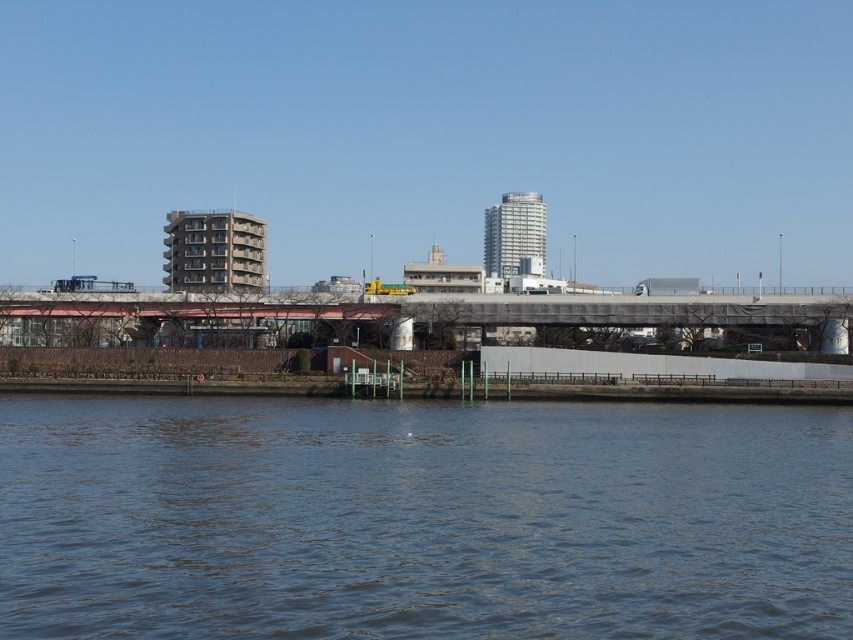
You are standing at the riverside and want to take a photo that includes both the blue water at lower center and the metallic gray bridge at center. Which object should you frame first to ensure both are visible in the photo?

You should frame the blue water at lower center first because it is larger than the metallic gray bridge at center, so capturing its full size will naturally include the bridge in the shot.

You are standing at the riverside and want to take a photo of both point (509, 618) and point (128, 317) in the scene. Which point should you focus on first to ensure both are in sharp focus?

You should focus on point (509, 618) first because it is closer to the camera than point (128, 317), ensuring both will be in focus when using depth of field properly.

You are a delivery drone with a wingspan of 1.5 meters. You need to fly from the blue water at lower center to the metallic gray bridge at center. Is there enough space between them for your drone to pass safely?

The distance between the blue water at lower center and the metallic gray bridge at center is 35.97 meters, which is more than sufficient for a drone with a 1.5 meter wingspan to pass safely between them.